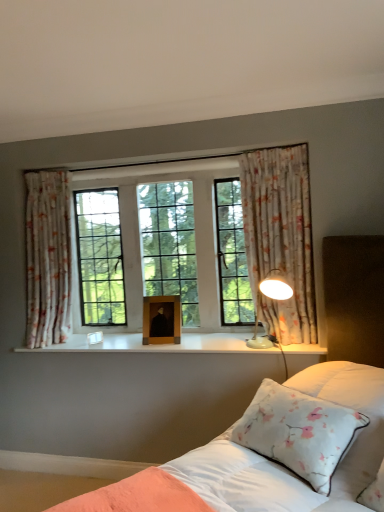
Question: Is wooden picture frame at center thinner than white floral pillow at lower right?

Choices:
 (A) yes
 (B) no

Answer: (A)

Question: From a real-world perspective, is wooden picture frame at center physically above white floral pillow at lower right?

Choices:
 (A) no
 (B) yes

Answer: (B)

Question: Would you say wooden picture frame at center is outside white floral pillow at lower right?

Choices:
 (A) no
 (B) yes

Answer: (B)

Question: Can you confirm if wooden picture frame at center is taller than white floral pillow at lower right?

Choices:
 (A) no
 (B) yes

Answer: (A)

Question: Can you confirm if wooden picture frame at center is positioned to the right of white floral pillow at lower right?

Choices:
 (A) yes
 (B) no

Answer: (B)

Question: From the image's perspective, is wooden picture frame at center located beneath white floral pillow at lower right?

Choices:
 (A) no
 (B) yes

Answer: (A)

Question: From a real-world perspective, is floral fabric curtain at right, which ranks as the 2th curtain in back-to-front order, located higher than white satin bed at center?

Choices:
 (A) yes
 (B) no

Answer: (A)

Question: Is floral fabric curtain at right, positioned as the 1th curtain in right-to-left order, thinner than white satin bed at center?

Choices:
 (A) yes
 (B) no

Answer: (A)

Question: Is floral fabric curtain at right, which ranks as the 2th curtain in back-to-front order, oriented towards white satin bed at center?

Choices:
 (A) no
 (B) yes

Answer: (B)

Question: From the image's perspective, would you say floral fabric curtain at right, positioned as the 2th curtain in left-to-right order, is positioned over white satin bed at center?

Choices:
 (A) yes
 (B) no

Answer: (A)

Question: Considering the relative sizes of floral fabric curtain at right, positioned as the 2th curtain in left-to-right order, and white satin bed at center in the image provided, is floral fabric curtain at right, positioned as the 2th curtain in left-to-right order, wider than white satin bed at center?

Choices:
 (A) no
 (B) yes

Answer: (A)

Question: Is the depth of floral fabric curtain at right, the first curtain when ordered from front to back, less than that of white satin bed at center?

Choices:
 (A) no
 (B) yes

Answer: (A)

Question: Is white glossy wood at center wider than floral fabric curtain at right, positioned as the 1th curtain in right-to-left order?

Choices:
 (A) no
 (B) yes

Answer: (B)